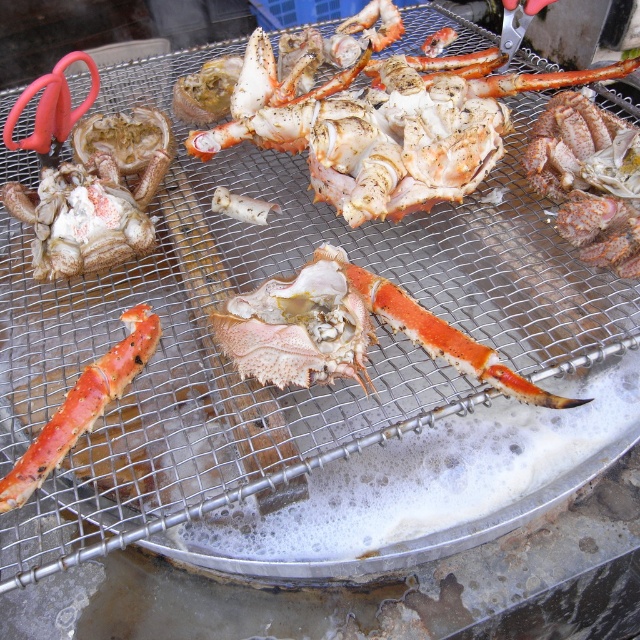
Who is more distant from viewer, (300, 332) or (90, 369)?

Positioned behind is point (90, 369).

Does point (476, 358) come behind point (140, 330)?

No, (476, 358) is closer to viewer.

Locate an element on the screen. pinkish-orange shell at center is located at coordinates (346, 332).

Identify the location of pinkish-orange shell at center. The width and height of the screenshot is (640, 640). (346, 332).

Is speckled white lobster at center further to the viewer compared to pinkish-orange shell at center?

Yes.

Is point (406, 122) in front of point (305, 310)?

No, it is behind (305, 310).

I want to click on speckled white lobster at center, so [x=381, y=124].

This screenshot has height=640, width=640. What do you see at coordinates (381, 124) in the screenshot?
I see `speckled white lobster at center` at bounding box center [381, 124].

Between point (380, 84) and point (109, 392), which one is positioned behind?

Point (380, 84)

Is point (348, 148) closer to viewer compared to point (58, 417)?

That is False.

Find the location of a particular element. The height and width of the screenshot is (640, 640). speckled white lobster at center is located at coordinates (381, 124).